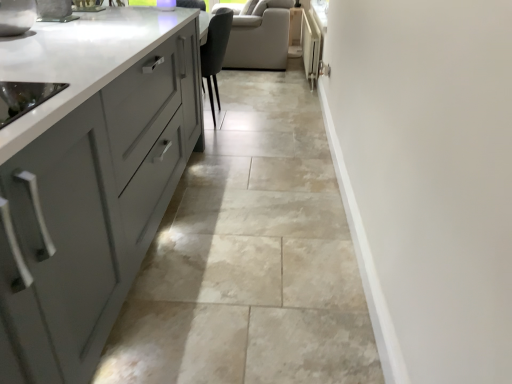
Question: Relative to natural stone floor at center, is white glossy radiator at upper right in front or behind?

Choices:
 (A) front
 (B) behind

Answer: (B)

Question: From the image's perspective, relative to natural stone floor at center, is white glossy radiator at upper right above or below?

Choices:
 (A) below
 (B) above

Answer: (B)

Question: Looking at the image, does white glossy radiator at upper right seem bigger or smaller compared to natural stone floor at center?

Choices:
 (A) big
 (B) small

Answer: (B)

Question: Considering the positions of natural stone floor at center and white glossy radiator at upper right in the image, is natural stone floor at center taller or shorter than white glossy radiator at upper right?

Choices:
 (A) short
 (B) tall

Answer: (A)

Question: Considering the positions of point (124, 327) and point (308, 34), is point (124, 327) closer or farther from the camera than point (308, 34)?

Choices:
 (A) closer
 (B) farther

Answer: (A)

Question: From the image's perspective, is natural stone floor at center located above or below white glossy radiator at upper right?

Choices:
 (A) below
 (B) above

Answer: (A)

Question: Considering the positions of natural stone floor at center and white glossy radiator at upper right in the image, is natural stone floor at center wider or thinner than white glossy radiator at upper right?

Choices:
 (A) thin
 (B) wide

Answer: (B)